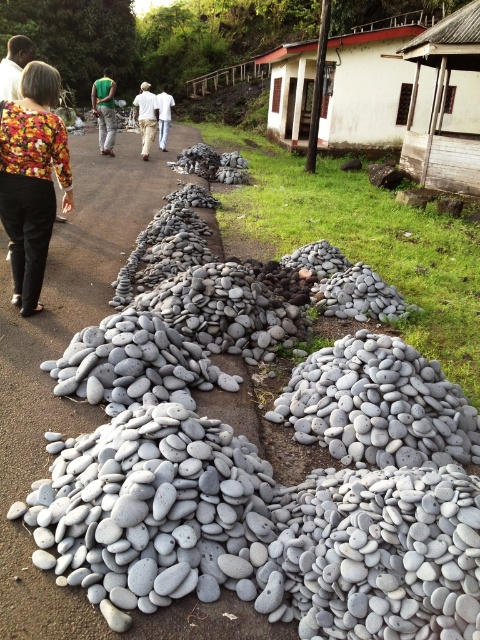
Between point (0, 120) and point (146, 125), which one is positioned in front?

Point (0, 120) is in front.

Can you confirm if floral fabric blouse at upper left is positioned above khaki pants at center?

Actually, floral fabric blouse at upper left is below khaki pants at center.

Image resolution: width=480 pixels, height=640 pixels. What do you see at coordinates (32, 179) in the screenshot? I see `floral fabric blouse at upper left` at bounding box center [32, 179].

Identify the location of floral fabric blouse at upper left. (32, 179).

Which is below, floral fabric blouse at upper left or green jersey at center?

floral fabric blouse at upper left is lower down.

Does floral fabric blouse at upper left have a lesser height compared to green jersey at center?

Indeed, floral fabric blouse at upper left has a lesser height compared to green jersey at center.

Between point (0, 188) and point (108, 96), which one is positioned in front?

Point (0, 188) is in front.

Find the location of a particular element. This screenshot has width=480, height=640. floral fabric blouse at upper left is located at coordinates (32, 179).

Based on the photo, who is positioned more to the left, green jersey at center or khaki pants at center?

Positioned to the left is green jersey at center.

The image size is (480, 640). In order to click on green jersey at center in this screenshot , I will do `click(105, 109)`.

Which is in front, point (110, 128) or point (155, 131)?

Point (110, 128) is in front.

Identify the location of green jersey at center. The width and height of the screenshot is (480, 640). (105, 109).